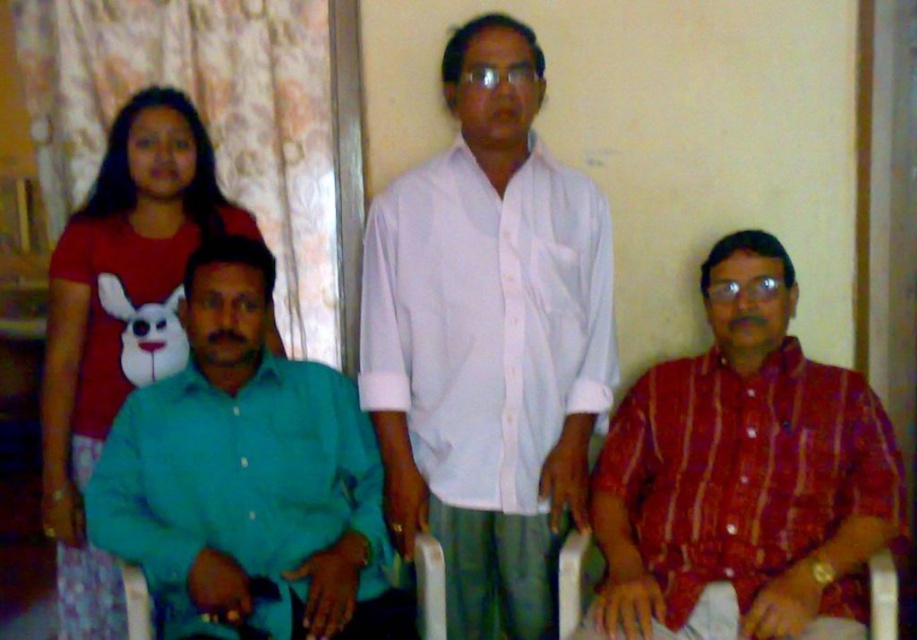
You are a photographer trying to adjust the lighting for a group photo. You notice two shirts in the scene, the white cotton shirt at center and the teal cotton shirt at left. Which shirt should you focus on to ensure proper exposure since it is closer to the camera?

The white cotton shirt at center is closer to the viewer than the teal cotton shirt at left, so you should focus on the white cotton shirt at center to ensure proper exposure.

You are a photographer adjusting the focus on your camera. You notice two points in the image at coordinates point (853, 611) and point (241, 595). Which point should you focus on to ensure the subject closer to the camera is sharp?

You should focus on point (853, 611) because it is further to the camera than point (241, 595), making it the closer subject.

You are standing in the room and want to move from the point at coordinates point (610, 304) to the point at coordinates point (161, 352). Can you walk directly between them without any obstacles?

The point at coordinates point (610, 304) is behind the point at coordinates point (161, 352), so there might be an obstacle blocking the path between them. Therefore, you cannot walk directly between them without any obstacles.